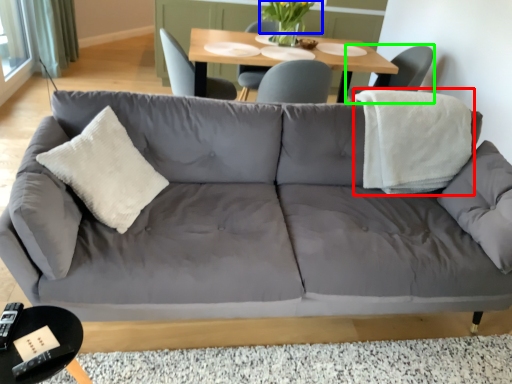
Question: Which object is the farthest from blanket (highlighted by a red box)? Choose among these: flower (highlighted by a blue box) or chair (highlighted by a green box).

Choices:
 (A) flower
 (B) chair

Answer: (A)